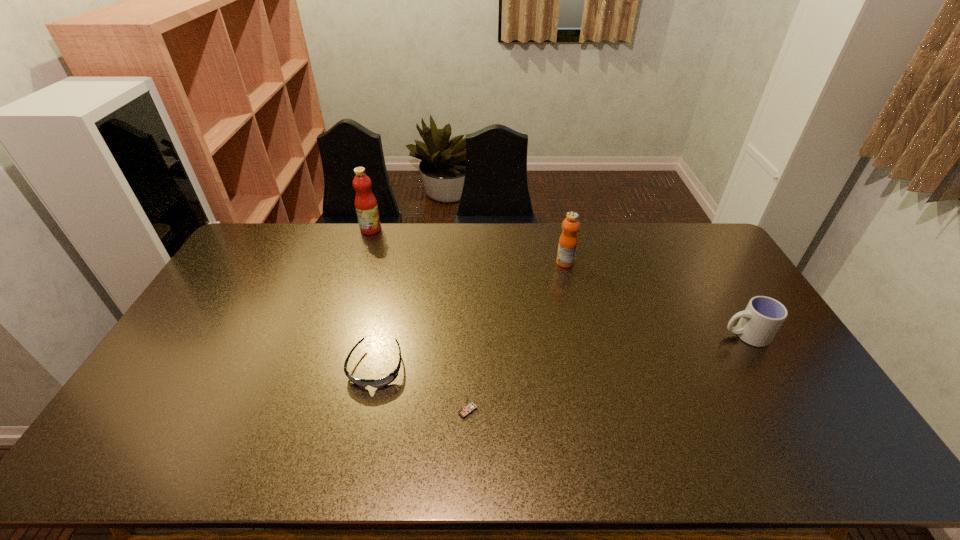
The height and width of the screenshot is (540, 960). I want to click on vacant region that satisfies the following two spatial constraints: 1. on the front label of the tallest object; 2. on the back side of the third object from right to left, so click(x=312, y=411).